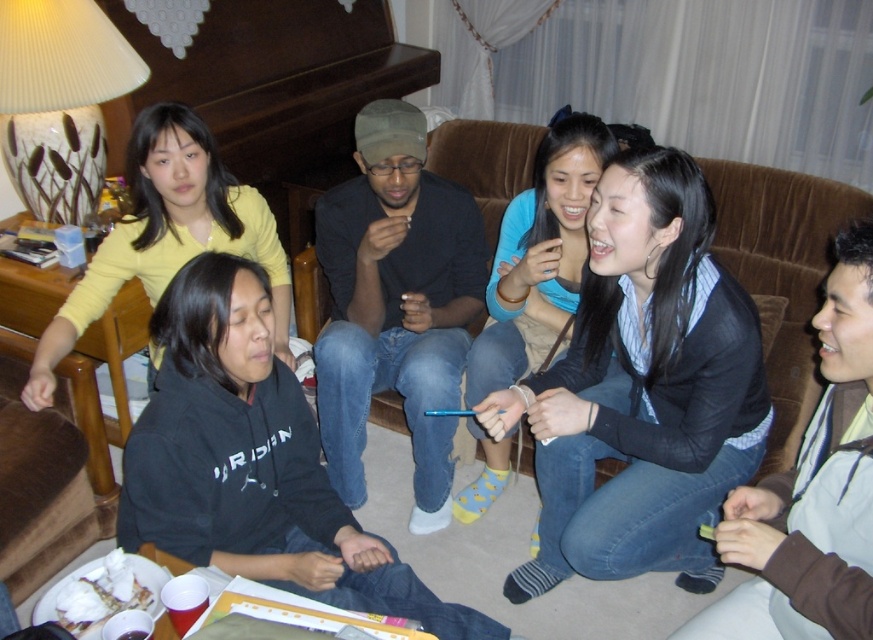
You are a photographer adjusting your camera settings to focus on the matte black jacket at center and the blue cotton socks at center. Which object should you focus on first to ensure both are in sharp focus?

The matte black jacket at center is closer to the viewer than the blue cotton socks at center. To ensure both are in sharp focus, you should focus on the matte black jacket at center first, as it is the closer object.